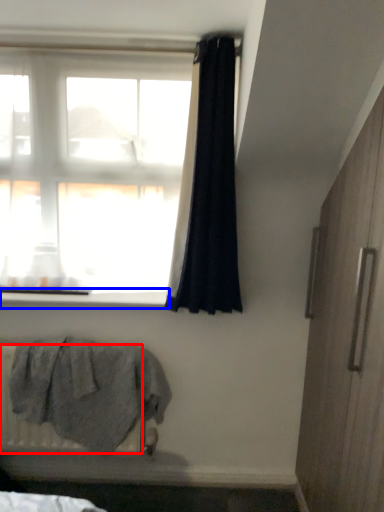
Question: Which object is closer to the camera taking this photo, radiator (highlighted by a red box) or window sill (highlighted by a blue box)?

Choices:
 (A) radiator
 (B) window sill

Answer: (A)